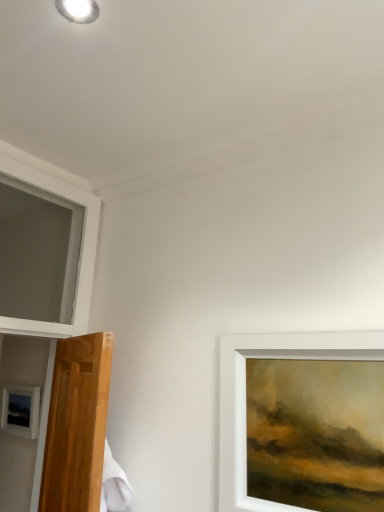
Question: Is white frame at upper left positioned in front of white glossy droplight at upper left?

Choices:
 (A) yes
 (B) no

Answer: (B)

Question: Does white frame at upper left have a smaller size compared to white glossy droplight at upper left?

Choices:
 (A) yes
 (B) no

Answer: (B)

Question: Is white frame at upper left at the right side of white glossy droplight at upper left?

Choices:
 (A) no
 (B) yes

Answer: (A)

Question: From the image's perspective, is white frame at upper left above white glossy droplight at upper left?

Choices:
 (A) yes
 (B) no

Answer: (B)

Question: Is the depth of white frame at upper left greater than that of white glossy droplight at upper left?

Choices:
 (A) yes
 (B) no

Answer: (A)

Question: Choose the correct answer: Is matte black picture frame at lower left inside white frame at upper left or outside it?

Choices:
 (A) inside
 (B) outside

Answer: (B)

Question: From the image's perspective, relative to white frame at upper left, is matte black picture frame at lower left above or below?

Choices:
 (A) above
 (B) below

Answer: (B)

Question: From a real-world perspective, relative to white frame at upper left, is matte black picture frame at lower left vertically above or below?

Choices:
 (A) above
 (B) below

Answer: (B)

Question: Looking at their shapes, would you say matte black picture frame at lower left is wider or thinner than white frame at upper left?

Choices:
 (A) thin
 (B) wide

Answer: (A)

Question: From a real-world perspective, is white frame at upper left positioned above or below matte black picture frame at lower left?

Choices:
 (A) below
 (B) above

Answer: (B)

Question: Is white frame at upper left taller or shorter than matte black picture frame at lower left?

Choices:
 (A) short
 (B) tall

Answer: (B)

Question: Looking at their shapes, would you say white frame at upper left is wider or thinner than matte black picture frame at lower left?

Choices:
 (A) wide
 (B) thin

Answer: (A)

Question: From the image's perspective, is white frame at upper left located above or below matte black picture frame at lower left?

Choices:
 (A) below
 (B) above

Answer: (B)

Question: Relative to white glossy droplight at upper left, is matte black picture frame at lower left in front or behind?

Choices:
 (A) front
 (B) behind

Answer: (B)

Question: Considering the positions of matte black picture frame at lower left and white glossy droplight at upper left in the image, is matte black picture frame at lower left wider or thinner than white glossy droplight at upper left?

Choices:
 (A) thin
 (B) wide

Answer: (A)